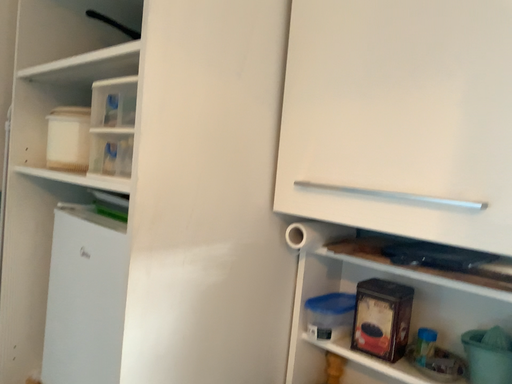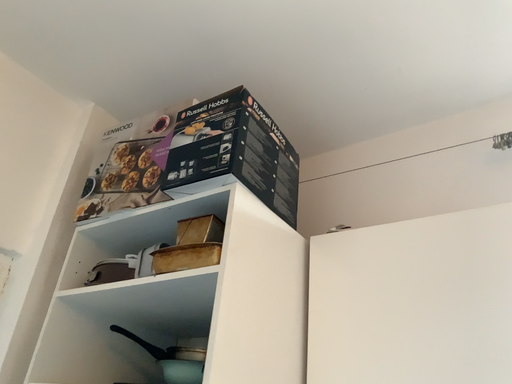
Question: How did the camera likely rotate when shooting the video?

Choices:
 (A) rotated upward
 (B) rotated downward

Answer: (A)